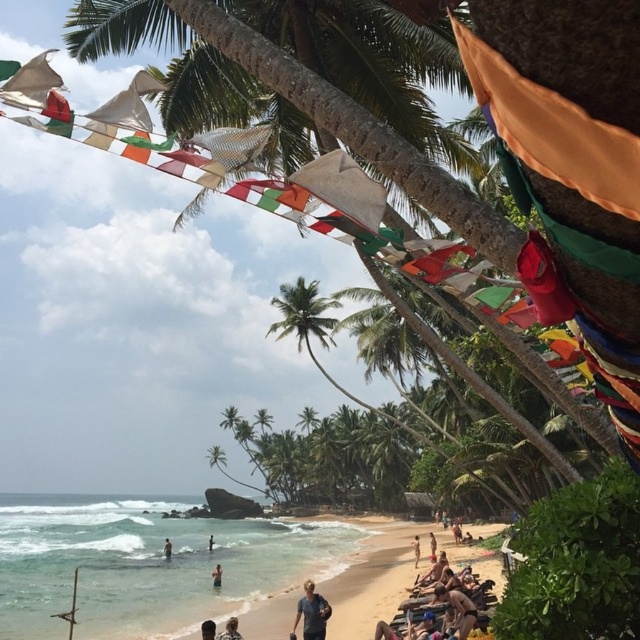
Question: Is smooth brown wooden stick at lower center to the right of smooth skin person at lower center from the viewer's perspective?

Choices:
 (A) no
 (B) yes

Answer: (B)

Question: Which object appears farthest from the camera in this image?

Choices:
 (A) light brown skin at beach center
 (B) light brown hair at lower center
 (C) smooth skin person at center
 (D) smooth brown wooden stick at lower center

Answer: (C)

Question: Which is farther from the brown textured palm tree at center?

Choices:
 (A) tan skin person at lower center
 (B) light brown hair at lower center

Answer: (A)

Question: Can you confirm if light brown skin at lower center is thinner than smooth skin person at center?

Choices:
 (A) yes
 (B) no

Answer: (A)

Question: Which object is closer to the camera taking this photo?

Choices:
 (A) beige sand beach at lower center
 (B) dark blue shirt at lower center

Answer: (B)

Question: Can you confirm if light brown hair at lower center is positioned to the right of smooth brown wooden stick at lower center?

Choices:
 (A) yes
 (B) no

Answer: (A)